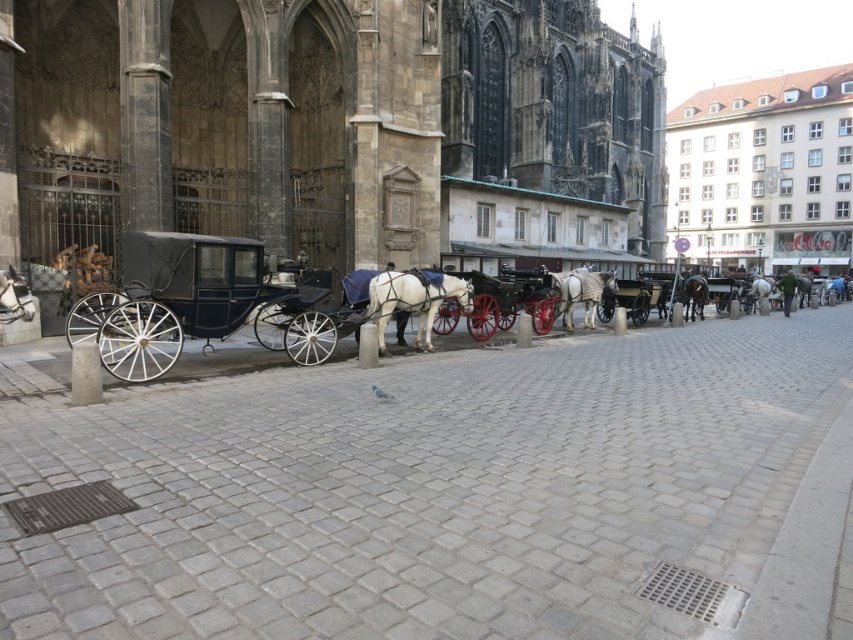
Question: Considering the relative positions of white glossy horse at center and shiny black coach at center in the image provided, where is white glossy horse at center located with respect to shiny black coach at center?

Choices:
 (A) right
 (B) left

Answer: (B)

Question: Estimate the real-world distances between objects in this image. Which object is closer to the shiny brown horse at center?

Choices:
 (A) white glossy horse at center
 (B) shiny black coach at center
 (C) white glossy cart at center
 (D) white glossy horse at left

Answer: (B)

Question: Among these objects, which one is farthest from the camera?

Choices:
 (A) white glossy horse at center
 (B) shiny black coach at center
 (C) white glossy horse at left
 (D) white glossy cart at center

Answer: (B)

Question: Does white glossy cart at center come in front of shiny black coach at center?

Choices:
 (A) no
 (B) yes

Answer: (B)

Question: Which point appears closest to the camera in this image?

Choices:
 (A) (105, 291)
 (B) (442, 310)
 (C) (786, 285)
 (D) (595, 280)

Answer: (A)

Question: Is shiny black carriage at left bigger than white matte horse at center?

Choices:
 (A) no
 (B) yes

Answer: (B)